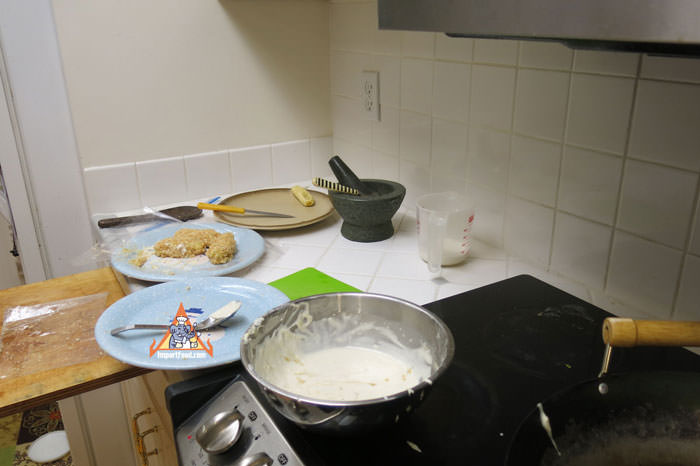
You are a GUI agent. You are given a task and a screenshot of the screen. Output one action in this format:
    pyautogui.click(x=<x>, y=<y>)
    Task: Click on the spoon
    
    Given the screenshot: What is the action you would take?
    pyautogui.click(x=213, y=321)